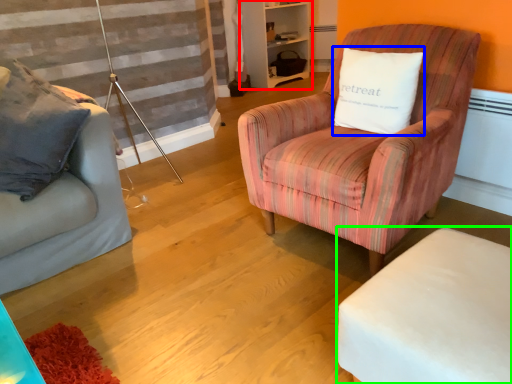
Question: Which is farther away from bookshelf (highlighted by a red box)? pillow (highlighted by a blue box) or table (highlighted by a green box)?

Choices:
 (A) pillow
 (B) table

Answer: (B)